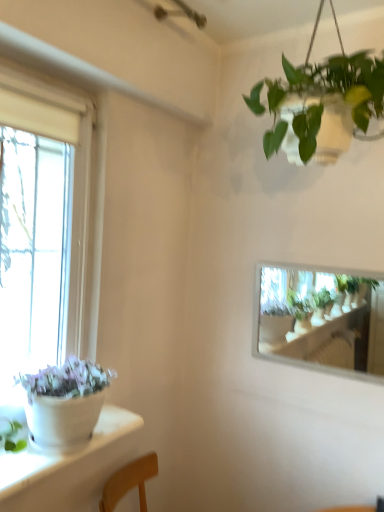
You are a GUI agent. You are given a task and a screenshot of the screen. Output one action in this format:
    pyautogui.click(x=<x>, y=<y>)
    Task: Click on the green leafy plant at upper center, which is the second houseplant from back to front
    
    Given the screenshot: What is the action you would take?
    pyautogui.click(x=321, y=94)

What is the approximate width of green leafy plant at upper center, which is the second houseplant from back to front?

17.73 inches.

The width and height of the screenshot is (384, 512). Describe the element at coordinates (321, 94) in the screenshot. I see `green leafy plant at upper center, which is the second houseplant in bottom-to-top order` at that location.

Measure the distance between green matte plant at upper right, the second houseplant in the front-to-back sequence, and camera.

The distance of green matte plant at upper right, the second houseplant in the front-to-back sequence, from camera is 1.79 meters.

How much space does green matte plant at upper right, the second houseplant in the front-to-back sequence, occupy horizontally?

The width of green matte plant at upper right, the second houseplant in the front-to-back sequence, is 2.45 centimeters.

Locate an element on the screen. green matte plant at upper right, which is the 2th houseplant from top to bottom is located at coordinates (296, 304).

This screenshot has width=384, height=512. What do you see at coordinates (296, 304) in the screenshot?
I see `green matte plant at upper right, the first houseplant in the bottom-to-top sequence` at bounding box center [296, 304].

Locate an element on the screen. The image size is (384, 512). green leafy plant at upper center, which appears as the first houseplant when viewed from the top is located at coordinates (321, 94).

Which is more to the right, green leafy plant at upper center, which is the second houseplant in bottom-to-top order, or green matte plant at upper right, which is the 2th houseplant from top to bottom?

Positioned to the right is green matte plant at upper right, which is the 2th houseplant from top to bottom.

Is green leafy plant at upper center, which appears as the first houseplant when viewed from the top, closer to camera compared to green matte plant at upper right, which appears as the first houseplant when viewed from the back?

Yes, green leafy plant at upper center, which appears as the first houseplant when viewed from the top, is closer to the viewer.

Does point (361, 64) come closer to viewer compared to point (297, 275)?

Yes.

From the picture: From the image's perspective, which object appears higher, green leafy plant at upper center, which is the second houseplant from back to front, or green matte plant at upper right, which appears as the first houseplant when viewed from the back?

From the image's view, green leafy plant at upper center, which is the second houseplant from back to front, is above.

In the scene shown: From a real-world perspective, does green leafy plant at upper center, which is the second houseplant in bottom-to-top order, stand above green matte plant at upper right, which appears as the first houseplant when viewed from the back?

Yes, from a real-world perspective, green leafy plant at upper center, which is the second houseplant in bottom-to-top order, is on top of green matte plant at upper right, which appears as the first houseplant when viewed from the back.

Which of these two, green leafy plant at upper center, positioned as the first houseplant in front-to-back order, or green matte plant at upper right, the first houseplant in the bottom-to-top sequence, is wider?

With larger width is green leafy plant at upper center, positioned as the first houseplant in front-to-back order.

From their relative heights in the image, would you say green leafy plant at upper center, which is the second houseplant in bottom-to-top order, is taller or shorter than green matte plant at upper right, the second houseplant in the front-to-back sequence?

Considering their sizes, green leafy plant at upper center, which is the second houseplant in bottom-to-top order, has more height than green matte plant at upper right, the second houseplant in the front-to-back sequence.

Considering the relative sizes of green leafy plant at upper center, which is the second houseplant in bottom-to-top order, and green matte plant at upper right, which is the 2th houseplant from top to bottom, in the image provided, is green leafy plant at upper center, which is the second houseplant in bottom-to-top order, bigger than green matte plant at upper right, which is the 2th houseplant from top to bottom,?

Indeed, green leafy plant at upper center, which is the second houseplant in bottom-to-top order, has a larger size compared to green matte plant at upper right, which is the 2th houseplant from top to bottom.

Is green leafy plant at upper center, which is the second houseplant from back to front, located outside green matte plant at upper right, the second houseplant in the front-to-back sequence?

Yes, green leafy plant at upper center, which is the second houseplant from back to front, is not within green matte plant at upper right, the second houseplant in the front-to-back sequence.

Is green leafy plant at upper center, positioned as the first houseplant in front-to-back order, touching green matte plant at upper right, the second houseplant in the front-to-back sequence?

No, green leafy plant at upper center, positioned as the first houseplant in front-to-back order, is not touching green matte plant at upper right, the second houseplant in the front-to-back sequence.

Does green leafy plant at upper center, which appears as the first houseplant when viewed from the top, turn towards green matte plant at upper right, the first houseplant in the bottom-to-top sequence?

No, green leafy plant at upper center, which appears as the first houseplant when viewed from the top, is not oriented towards green matte plant at upper right, the first houseplant in the bottom-to-top sequence.

Could you measure the distance between green leafy plant at upper center, positioned as the first houseplant in front-to-back order, and green matte plant at upper right, which is the 2th houseplant from top to bottom?

green leafy plant at upper center, positioned as the first houseplant in front-to-back order, is 3.47 feet from green matte plant at upper right, which is the 2th houseplant from top to bottom.

The height and width of the screenshot is (512, 384). I want to click on houseplant that appears behind the green leafy plant at upper center, positioned as the first houseplant in front-to-back order, so click(296, 304).

Can you confirm if green matte plant at upper right, which is the 2th houseplant from top to bottom, is positioned to the left of green leafy plant at upper center, which appears as the first houseplant when viewed from the top?

No.

Which object is closer to the camera taking this photo, green matte plant at upper right, which appears as the first houseplant when viewed from the back, or green leafy plant at upper center, which is the second houseplant from back to front?

green leafy plant at upper center, which is the second houseplant from back to front, is in front.

Which is behind, point (375, 283) or point (334, 82)?

The point (375, 283) is behind.

From the image's perspective, is green matte plant at upper right, which appears as the first houseplant when viewed from the back, positioned above or below green leafy plant at upper center, which appears as the first houseplant when viewed from the top?

Clearly, from the image's perspective, green matte plant at upper right, which appears as the first houseplant when viewed from the back, is below green leafy plant at upper center, which appears as the first houseplant when viewed from the top.

From a real-world perspective, does green matte plant at upper right, which appears as the first houseplant when viewed from the back, sit lower than green leafy plant at upper center, positioned as the first houseplant in front-to-back order?

Yes.

Which of these two, green matte plant at upper right, the second houseplant in the front-to-back sequence, or green leafy plant at upper center, which is the second houseplant from back to front, is thinner?

With smaller width is green matte plant at upper right, the second houseplant in the front-to-back sequence.

Considering the sizes of green matte plant at upper right, the first houseplant in the bottom-to-top sequence, and green leafy plant at upper center, which appears as the first houseplant when viewed from the top, in the image, is green matte plant at upper right, the first houseplant in the bottom-to-top sequence, taller or shorter than green leafy plant at upper center, which appears as the first houseplant when viewed from the top,?

Considering their sizes, green matte plant at upper right, the first houseplant in the bottom-to-top sequence, has less height than green leafy plant at upper center, which appears as the first houseplant when viewed from the top.

Considering the sizes of green matte plant at upper right, which is the 2th houseplant from top to bottom, and green leafy plant at upper center, positioned as the first houseplant in front-to-back order, in the image, is green matte plant at upper right, which is the 2th houseplant from top to bottom, bigger or smaller than green leafy plant at upper center, positioned as the first houseplant in front-to-back order,?

In the image, green matte plant at upper right, which is the 2th houseplant from top to bottom, appears to be smaller than green leafy plant at upper center, positioned as the first houseplant in front-to-back order.

Can we say green matte plant at upper right, which appears as the first houseplant when viewed from the back, lies outside green leafy plant at upper center, which is the second houseplant in bottom-to-top order?

Absolutely, green matte plant at upper right, which appears as the first houseplant when viewed from the back, is external to green leafy plant at upper center, which is the second houseplant in bottom-to-top order.

Is green matte plant at upper right, the second houseplant in the front-to-back sequence, next to green leafy plant at upper center, which is the second houseplant from back to front?

No, green matte plant at upper right, the second houseplant in the front-to-back sequence, is not in contact with green leafy plant at upper center, which is the second houseplant from back to front.

Is green matte plant at upper right, the second houseplant in the front-to-back sequence, aimed at green leafy plant at upper center, which is the second houseplant in bottom-to-top order?

No, green matte plant at upper right, the second houseplant in the front-to-back sequence, is not oriented towards green leafy plant at upper center, which is the second houseplant in bottom-to-top order.

What's the angular difference between green matte plant at upper right, which is the 2th houseplant from top to bottom, and green leafy plant at upper center, which is the second houseplant in bottom-to-top order,'s facing directions?

They differ by 2.6 degrees in their facing directions.

This screenshot has width=384, height=512. What are the coordinates of `houseplant lying on the left of green matte plant at upper right, which is the 2th houseplant from top to bottom` in the screenshot? It's located at (321, 94).

Identify the location of houseplant below the green leafy plant at upper center, which is the second houseplant in bottom-to-top order (from a real-world perspective). (296, 304).

The image size is (384, 512). In order to click on houseplant that is above the green matte plant at upper right, the first houseplant in the bottom-to-top sequence (from the image's perspective) in this screenshot , I will do `click(321, 94)`.